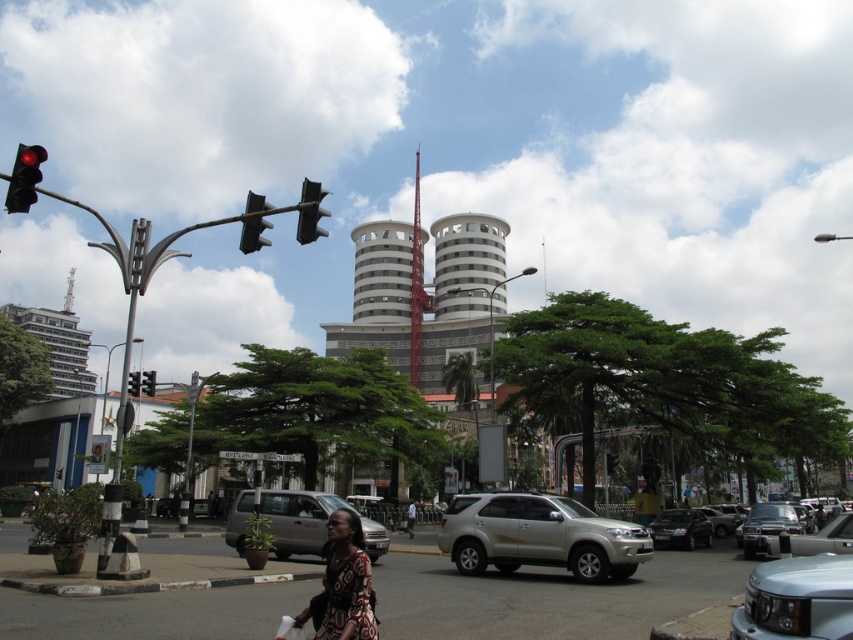
Who is higher up, metallic traffic light at upper center or matte black traffic light at upper left?

metallic traffic light at upper center is above.

Describe the element at coordinates (310, 212) in the screenshot. This screenshot has height=640, width=853. I see `metallic traffic light at upper center` at that location.

Where is `metallic traffic light at upper center`? This screenshot has width=853, height=640. metallic traffic light at upper center is located at coordinates (310, 212).

I want to click on white textured building at center, so click(x=381, y=272).

Is white textured building at center behind brown textured dress at center?

Yes.

Where is `white textured building at center`? The image size is (853, 640). white textured building at center is located at coordinates (381, 272).

Does silver metallic van at center have a smaller size compared to matte black traffic light at upper left?

Correct, silver metallic van at center occupies less space than matte black traffic light at upper left.

Describe the element at coordinates (299, 518) in the screenshot. I see `silver metallic van at center` at that location.

Where is `silver metallic van at center`? The image size is (853, 640). silver metallic van at center is located at coordinates (299, 518).